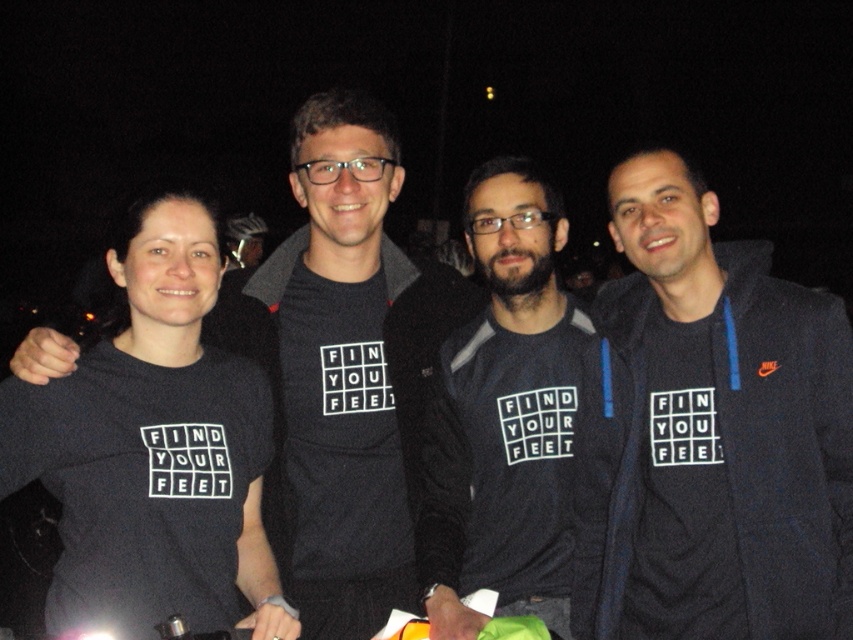
Which is below, black fleece jacket at right or matte black t-shirt at center?

Positioned lower is black fleece jacket at right.

Between black fleece jacket at right and matte black t-shirt at center, which one appears on the left side from the viewer's perspective?

From the viewer's perspective, matte black t-shirt at center appears more on the left side.

In order to click on black fleece jacket at right in this screenshot , I will do pos(720,428).

Locate an element on the screen. black fleece jacket at right is located at coordinates (720, 428).

Can you confirm if matte black t-shirt at center is positioned below dark gray sweatshirt at center?

Incorrect, matte black t-shirt at center is not positioned below dark gray sweatshirt at center.

Who is lower down, matte black t-shirt at center or dark gray sweatshirt at center?

dark gray sweatshirt at center is lower down.

Is point (479, 301) more distant than point (527, 433)?

Yes, it is behind point (527, 433).

Locate an element on the screen. matte black t-shirt at center is located at coordinates (349, 372).

Measure the distance from black fleece jacket at right to dark gray sweatshirt at center.

The distance of black fleece jacket at right from dark gray sweatshirt at center is 10.43 inches.

What do you see at coordinates (720, 428) in the screenshot? This screenshot has width=853, height=640. I see `black fleece jacket at right` at bounding box center [720, 428].

I want to click on black fleece jacket at right, so click(720, 428).